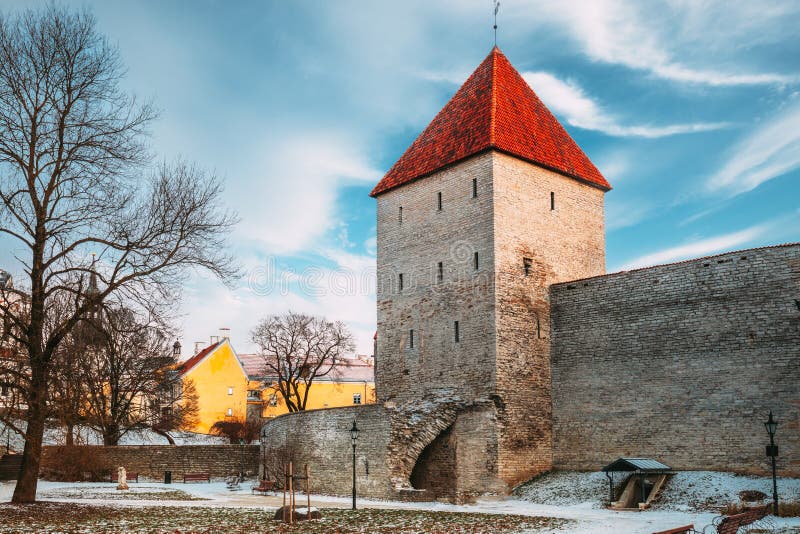
Where is `wooden bench`? This screenshot has width=800, height=534. wooden bench is located at coordinates (190, 478), (113, 478).